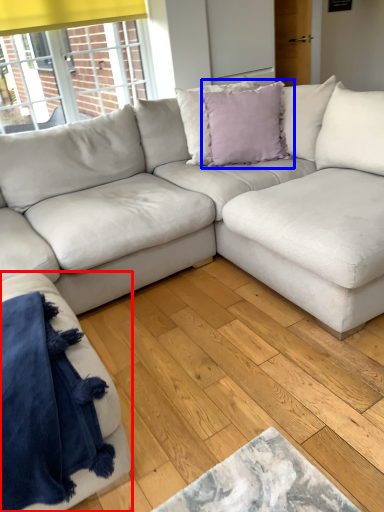
Question: Which object appears closest to the camera in this image, studio couch (highlighted by a red box) or pillow (highlighted by a blue box)?

Choices:
 (A) studio couch
 (B) pillow

Answer: (A)